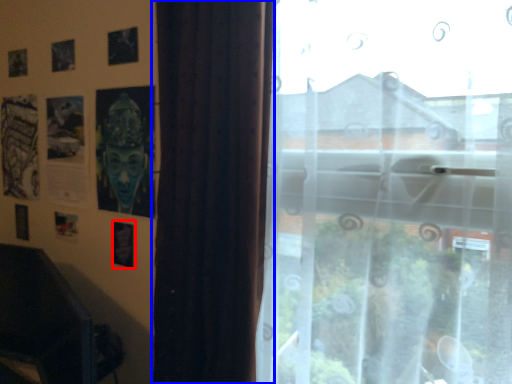
Question: Which point is further to the camera, picture frame (highlighted by a red box) or curtain (highlighted by a blue box)?

Choices:
 (A) picture frame
 (B) curtain

Answer: (A)